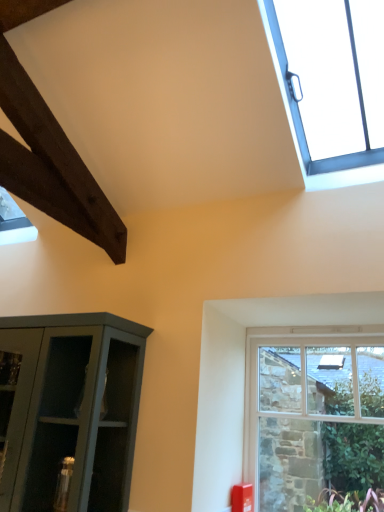
Question: Is clear glass window at upper right, which is the second window from bottom to top, to the right of clear glass window at lower right, placed as the first window when sorted from bottom to top, from the viewer's perspective?

Choices:
 (A) yes
 (B) no

Answer: (B)

Question: Considering the relative sizes of clear glass window at upper right, marked as the 1th window in a top-to-bottom arrangement, and clear glass window at lower right, the second window from the top, in the image provided, is clear glass window at upper right, marked as the 1th window in a top-to-bottom arrangement, wider than clear glass window at lower right, the second window from the top,?

Choices:
 (A) no
 (B) yes

Answer: (B)

Question: Can you confirm if clear glass window at upper right, marked as the 1th window in a top-to-bottom arrangement, is positioned to the left of clear glass window at lower right, placed as the first window when sorted from bottom to top?

Choices:
 (A) yes
 (B) no

Answer: (A)

Question: From the image's perspective, would you say clear glass window at upper right, which is the second window from bottom to top, is shown under clear glass window at lower right, the second window from the top?

Choices:
 (A) yes
 (B) no

Answer: (B)

Question: Is there a large distance between clear glass window at upper right, marked as the 1th window in a top-to-bottom arrangement, and clear glass window at lower right, the second window from the top?

Choices:
 (A) no
 (B) yes

Answer: (B)

Question: Is clear glass window at lower right, placed as the first window when sorted from bottom to top, completely or partially inside clear glass window at upper right, marked as the 1th window in a top-to-bottom arrangement?

Choices:
 (A) yes
 (B) no

Answer: (B)

Question: Is the surface of clear glass window at lower right, placed as the first window when sorted from bottom to top, in direct contact with clear glass window at upper right, marked as the 1th window in a top-to-bottom arrangement?

Choices:
 (A) no
 (B) yes

Answer: (A)

Question: From the image's perspective, is clear glass window at lower right, the second window from the top, over clear glass window at upper right, marked as the 1th window in a top-to-bottom arrangement?

Choices:
 (A) no
 (B) yes

Answer: (A)

Question: Is clear glass window at lower right, placed as the first window when sorted from bottom to top, aimed at clear glass window at upper right, which is the second window from bottom to top?

Choices:
 (A) no
 (B) yes

Answer: (A)

Question: Is clear glass window at lower right, the second window from the top, bigger than clear glass window at upper right, which is the second window from bottom to top?

Choices:
 (A) no
 (B) yes

Answer: (A)

Question: Is clear glass window at lower right, placed as the first window when sorted from bottom to top, outside clear glass window at upper right, marked as the 1th window in a top-to-bottom arrangement?

Choices:
 (A) yes
 (B) no

Answer: (A)

Question: Is clear glass window at lower right, the second window from the top, oriented away from clear glass window at upper right, marked as the 1th window in a top-to-bottom arrangement?

Choices:
 (A) no
 (B) yes

Answer: (A)

Question: From the image's perspective, is clear glass window at lower right, placed as the first window when sorted from bottom to top, located above or below clear glass window at upper right, which is the second window from bottom to top?

Choices:
 (A) above
 (B) below

Answer: (B)